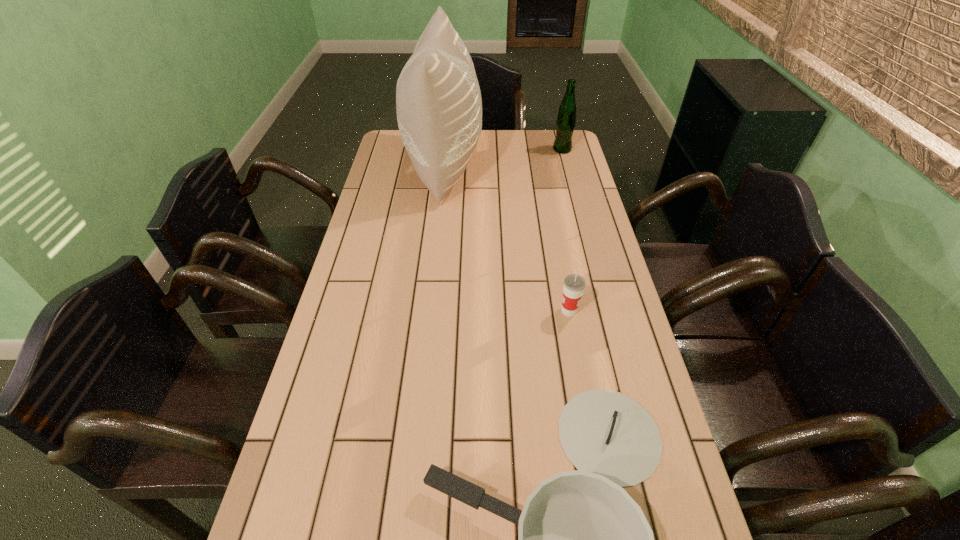
The width and height of the screenshot is (960, 540). What are the coordinates of `beer bottle that is at the far edge` in the screenshot? It's located at (566, 119).

Where is `object that is at the left edge`? The height and width of the screenshot is (540, 960). object that is at the left edge is located at coordinates (438, 101).

At what (x,y) coordinates should I click in order to perform the action: click on beer bottle at the right edge. Please return your answer as a coordinate pair (x, y). Looking at the image, I should click on (566, 119).

You are a GUI agent. You are given a task and a screenshot of the screen. Output one action in this format:
    pyautogui.click(x=<x>, y=<y>)
    Task: Click on the cup that is at the right edge
    
    Given the screenshot: What is the action you would take?
    pyautogui.click(x=573, y=288)

Identify the location of object that is at the far left corner. Image resolution: width=960 pixels, height=540 pixels. (438, 101).

You are a GUI agent. You are given a task and a screenshot of the screen. Output one action in this format:
    pyautogui.click(x=<x>, y=<y>)
    Task: Click on the object present at the far right corner
    This screenshot has width=960, height=540.
    Given the screenshot: What is the action you would take?
    pyautogui.click(x=566, y=119)

At what (x,y) coordinates should I click in order to perform the action: click on vacant space at the far edge of the desktop. Please return your answer as a coordinate pair (x, y). Image resolution: width=960 pixels, height=540 pixels. Looking at the image, I should click on (528, 134).

In the image, there is a desktop. Identify the location of vacant region at the left edge. (287, 459).

Where is `vacant region at the right edge of the desktop`? vacant region at the right edge of the desktop is located at coordinates (x=584, y=195).

This screenshot has width=960, height=540. In order to click on free space between the second tallest object and the tallest object in this screenshot , I will do `click(503, 158)`.